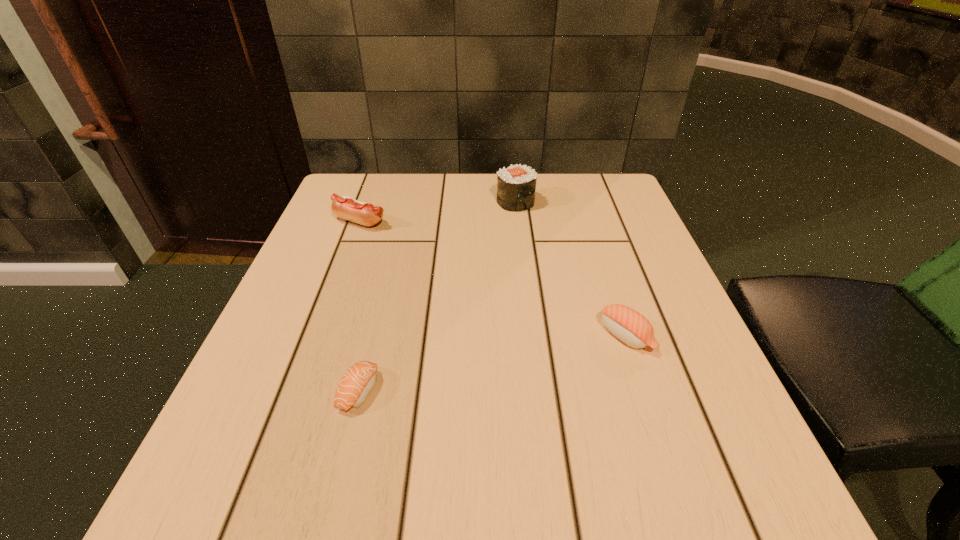
Where is `free space at the near left corner`? Image resolution: width=960 pixels, height=540 pixels. free space at the near left corner is located at coordinates (245, 507).

Identify the location of vacant space at the far right corner. (578, 190).

Locate an element on the screen. The width and height of the screenshot is (960, 540). empty space between the second nearest object and the second object from left to right is located at coordinates (492, 363).

The image size is (960, 540). Find the location of `vacant area between the second farthest sushi and the nearest object`. vacant area between the second farthest sushi and the nearest object is located at coordinates (492, 363).

You are a GUI agent. You are given a task and a screenshot of the screen. Output one action in this format:
    pyautogui.click(x=<x>, y=<y>)
    Task: Click on the free point between the leftmost object and the nearest sushi
    The height and width of the screenshot is (540, 960).
    Given the screenshot: What is the action you would take?
    pyautogui.click(x=360, y=306)

Locate an element on the screen. vacant point located between the shortest object and the second shortest sushi is located at coordinates (492, 363).

Find the location of a particular element. The width and height of the screenshot is (960, 540). vacant region between the leftmost sushi and the sausage is located at coordinates (360, 306).

At what (x,y) coordinates should I click in order to perform the action: click on empty location between the sausage and the tallest object. Please return your answer as a coordinate pair (x, y). Looking at the image, I should click on (438, 212).

You are a GUI agent. You are given a task and a screenshot of the screen. Output one action in this format:
    pyautogui.click(x=<x>, y=<y>)
    Task: Click on the free space between the sausage and the second nearest sushi
    
    Given the screenshot: What is the action you would take?
    pyautogui.click(x=493, y=279)

At what (x,y) coordinates should I click in order to perform the action: click on vacant point located between the rightmost object and the farthest sushi. Please return your answer as a coordinate pair (x, y). The image size is (960, 540). Looking at the image, I should click on (570, 269).